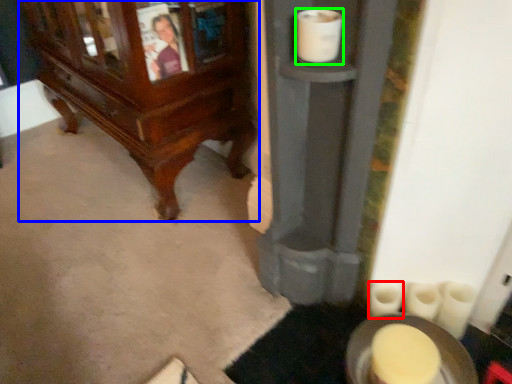
Question: Which object is positioned closest to toilet paper (highlighted by a red box)? Select from furniture (highlighted by a blue box) and toilet paper (highlighted by a green box).

Choices:
 (A) furniture
 (B) toilet paper

Answer: (B)